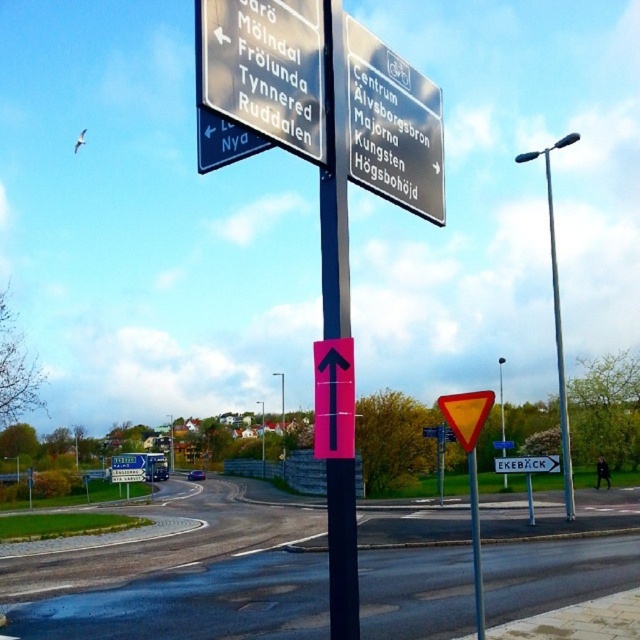
Question: Does metallic silver sign at upper center lie behind black plastic pole at center?

Choices:
 (A) no
 (B) yes

Answer: (B)

Question: Among these objects, which one is farthest from the camera?

Choices:
 (A) metallic silver sign at upper center
 (B) black plastic pole at center

Answer: (A)

Question: Is metallic silver sign at upper center smaller than black plastic pole at center?

Choices:
 (A) no
 (B) yes

Answer: (B)

Question: Among these points, which one is nearest to the camera?

Choices:
 (A) (406, 166)
 (B) (355, 628)

Answer: (B)

Question: Can you confirm if metallic silver sign at upper center is positioned to the left of black plastic pole at center?

Choices:
 (A) no
 (B) yes

Answer: (B)